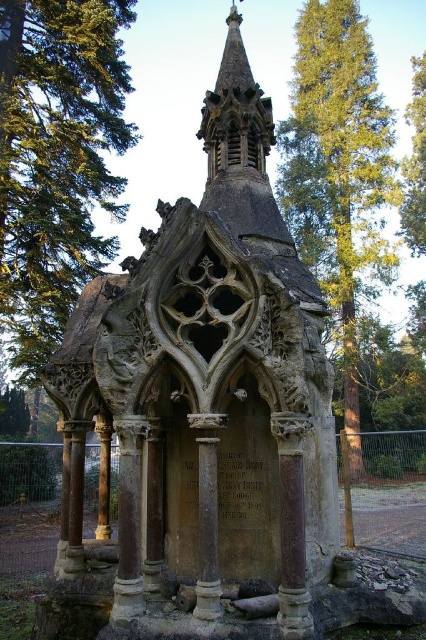
You are standing in front of the Gothic mausoleum and notice two points marked on the structure. The first point is at coordinates point (69,70) and the second is at point (417,65). Which of these points is nearer to your current position?

Point (69,70) is closer to the camera than point (417,65), so the first point is nearer to your current position.